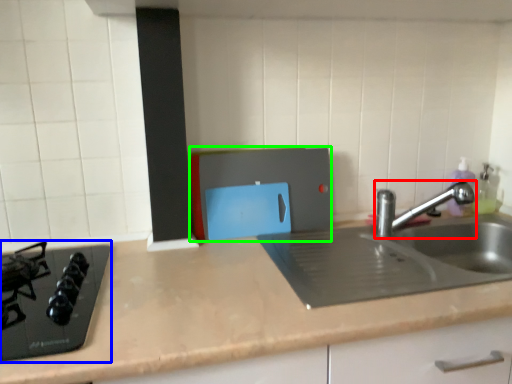
Question: Considering the real-world distances, which object is closest to tap (highlighted by a red box)? gas stove (highlighted by a blue box) or appliance (highlighted by a green box).

Choices:
 (A) gas stove
 (B) appliance

Answer: (B)